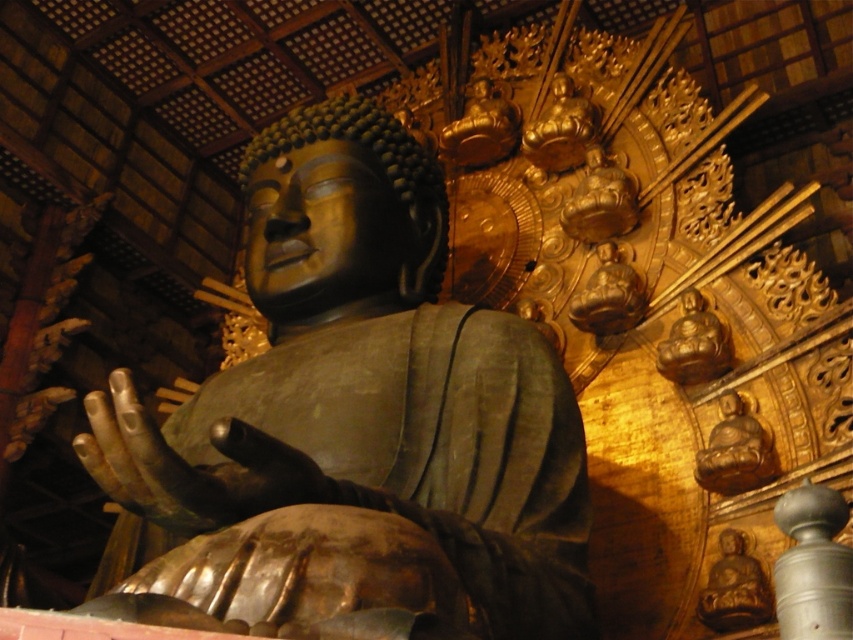
Which is above, matte gold statue at upper right or gold polished statue at upper right?

Positioned higher is gold polished statue at upper right.

Between point (755, 481) and point (701, 378), which one is positioned in front?

Point (755, 481) is more forward.

Locate an element on the screen. Image resolution: width=853 pixels, height=640 pixels. matte gold statue at upper right is located at coordinates (735, 451).

Looking at this image, can you confirm if bronze statue at center is shorter than gold polished statue at lower right?

In fact, bronze statue at center may be taller than gold polished statue at lower right.

Who is positioned more to the right, bronze statue at center or gold polished statue at lower right?

Positioned to the right is gold polished statue at lower right.

Is point (367, 173) positioned in front of point (730, 588)?

No, it is not.

I want to click on bronze statue at center, so click(x=357, y=420).

Between gold polished statue at lower right and gold polished statue at upper right, which one is positioned higher?

gold polished statue at upper right is above.

Does point (740, 572) come farther from viewer compared to point (730, 353)?

No, it is in front of (730, 353).

Between point (759, 618) and point (688, 355), which one is positioned in front?

Point (759, 618)

Locate an element on the screen. Image resolution: width=853 pixels, height=640 pixels. gold polished statue at lower right is located at coordinates (734, 588).